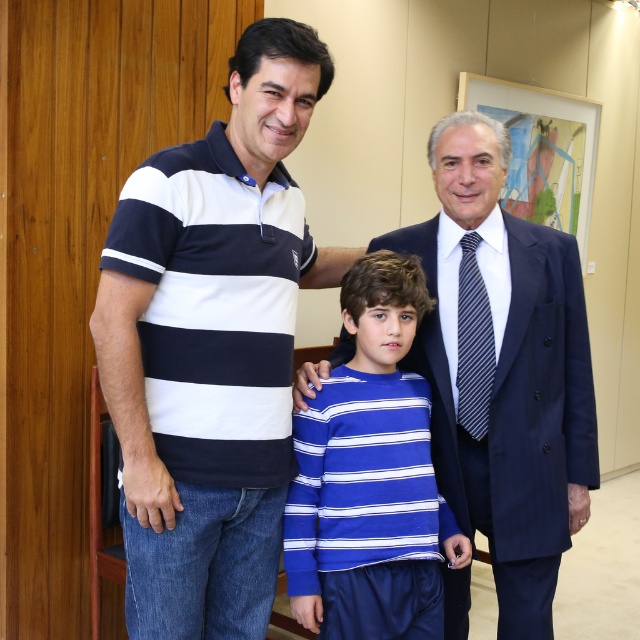
Question: Is navy blue striped polo shirt at center closer to camera compared to navy blue and white striped polo shirt at left?

Choices:
 (A) yes
 (B) no

Answer: (B)

Question: Based on their relative distances, which object is farther from the blue striped sweater at center?

Choices:
 (A) blue striped shirt at center
 (B) navy blue and white striped polo shirt at left
 (C) navy blue striped polo shirt at center

Answer: (B)

Question: Which of the following is the farthest from the observer?

Choices:
 (A) (483, 136)
 (B) (268, 205)
 (C) (481, 298)

Answer: (C)

Question: Considering the real-world distances, which object is closest to the navy blue and white striped polo shirt at left?

Choices:
 (A) blue striped sweater at center
 (B) striped fabric tie at right
 (C) blue striped shirt at center
 (D) navy blue striped polo shirt at center

Answer: (D)

Question: Can you confirm if navy blue striped polo shirt at center is positioned to the left of blue striped sweater at center?

Choices:
 (A) yes
 (B) no

Answer: (A)

Question: Is blue striped sweater at center to the left of striped fabric tie at right from the viewer's perspective?

Choices:
 (A) no
 (B) yes

Answer: (B)